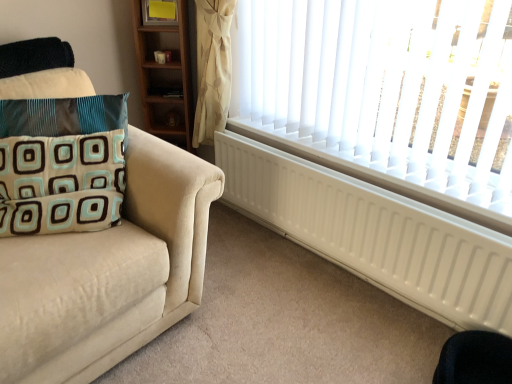
Question: Considering the relative sizes of black fabric swivel chair at lower right and teal velvet pillow at left in the image provided, is black fabric swivel chair at lower right thinner than teal velvet pillow at left?

Choices:
 (A) no
 (B) yes

Answer: (A)

Question: Is black fabric swivel chair at lower right next to teal velvet pillow at left?

Choices:
 (A) no
 (B) yes

Answer: (A)

Question: Is black fabric swivel chair at lower right outside of teal velvet pillow at left?

Choices:
 (A) yes
 (B) no

Answer: (A)

Question: Is black fabric swivel chair at lower right closer to camera compared to teal velvet pillow at left?

Choices:
 (A) yes
 (B) no

Answer: (A)

Question: Is black fabric swivel chair at lower right oriented away from teal velvet pillow at left?

Choices:
 (A) no
 (B) yes

Answer: (A)

Question: In terms of height, does black fabric swivel chair at lower right look taller or shorter compared to white matte radiator at lower right?

Choices:
 (A) short
 (B) tall

Answer: (A)

Question: Would you say black fabric swivel chair at lower right is to the left or to the right of white matte radiator at lower right in the picture?

Choices:
 (A) right
 (B) left

Answer: (A)

Question: From a real-world perspective, is black fabric swivel chair at lower right physically located above or below white matte radiator at lower right?

Choices:
 (A) below
 (B) above

Answer: (A)

Question: Which is correct: black fabric swivel chair at lower right is inside white matte radiator at lower right, or outside of it?

Choices:
 (A) outside
 (B) inside

Answer: (A)

Question: In the image, is white matte radiator at lower right on the left side or the right side of teal velvet pillow at left?

Choices:
 (A) right
 (B) left

Answer: (A)

Question: Is white matte radiator at lower right situated inside teal velvet pillow at left or outside?

Choices:
 (A) outside
 (B) inside

Answer: (A)

Question: In the image, is white matte radiator at lower right positioned in front of or behind teal velvet pillow at left?

Choices:
 (A) behind
 (B) front

Answer: (A)

Question: Considering the positions of point (236, 134) and point (84, 115), is point (236, 134) closer or farther from the camera than point (84, 115)?

Choices:
 (A) farther
 (B) closer

Answer: (A)

Question: Is point (407, 269) closer or farther from the camera than point (445, 345)?

Choices:
 (A) farther
 (B) closer

Answer: (A)

Question: From a real-world perspective, is white matte radiator at lower right above or below black fabric swivel chair at lower right?

Choices:
 (A) below
 (B) above

Answer: (B)